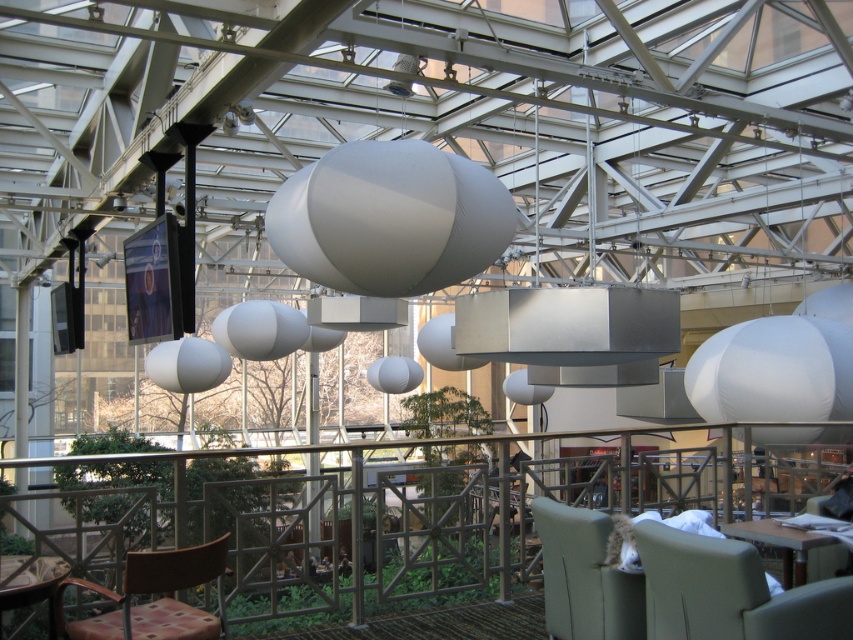
You are sitting in the gray fabric armchair at lower right and want to move to the gray fabric chair at lower right. Which direction should you move to reach it?

The gray fabric chair at lower right is positioned on the right side of the gray fabric armchair at lower right, so you should move to your right to reach it.

You are a person with a 24 inch wide wheelchair. You want to move between the gray fabric chair at lower right and the gray fabric armchair at lower right. Can your wheelchair fit through the space between them?

The gray fabric chair at lower right and the gray fabric armchair at lower right are 22.65 inches apart. Since the wheelchair is 24 inches wide, it cannot fit through the space between them as the gap is narrower than the wheelchair.